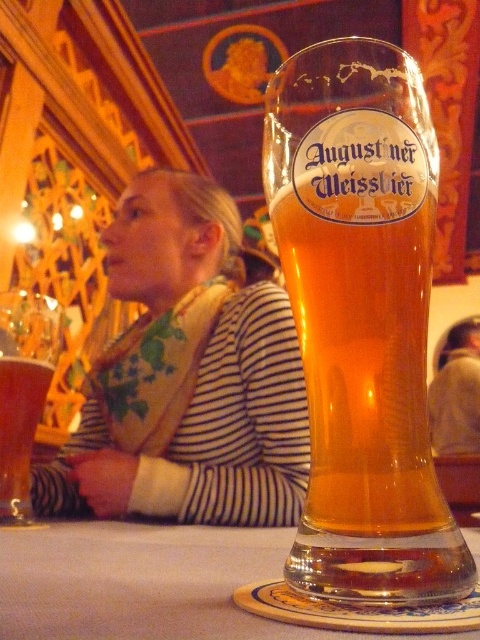
Who is lower down, striped fabric scarf at upper left or white cloth table at center?

white cloth table at center is lower down.

Identify the location of striped fabric scarf at upper left. (200, 433).

Is white cloth table at center in front of translucent glass mug at left?

Yes, it is.

The width and height of the screenshot is (480, 640). In order to click on white cloth table at center in this screenshot , I will do 144,582.

Locate an element on the screen. The height and width of the screenshot is (640, 480). white cloth table at center is located at coordinates (144, 582).

Is the position of translucent glass beer glass at center more distant than that of translucent glass mug at left?

No, it is in front of translucent glass mug at left.

From the picture: Measure the distance between translucent glass beer glass at center and camera.

translucent glass beer glass at center and camera are 9.79 inches apart.

Locate an element on the screen. The height and width of the screenshot is (640, 480). translucent glass beer glass at center is located at coordinates (361, 320).